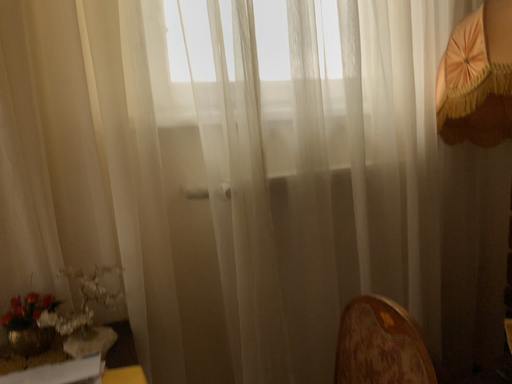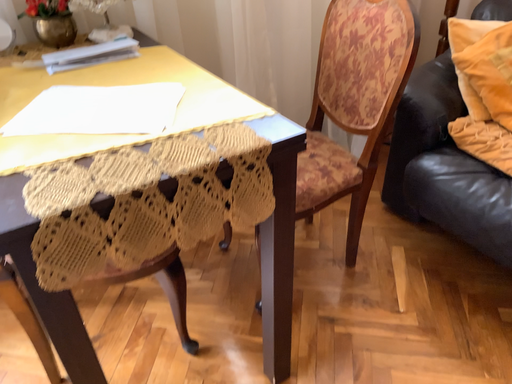
Question: Which way did the camera rotate in the video?

Choices:
 (A) rotated left
 (B) rotated right

Answer: (B)